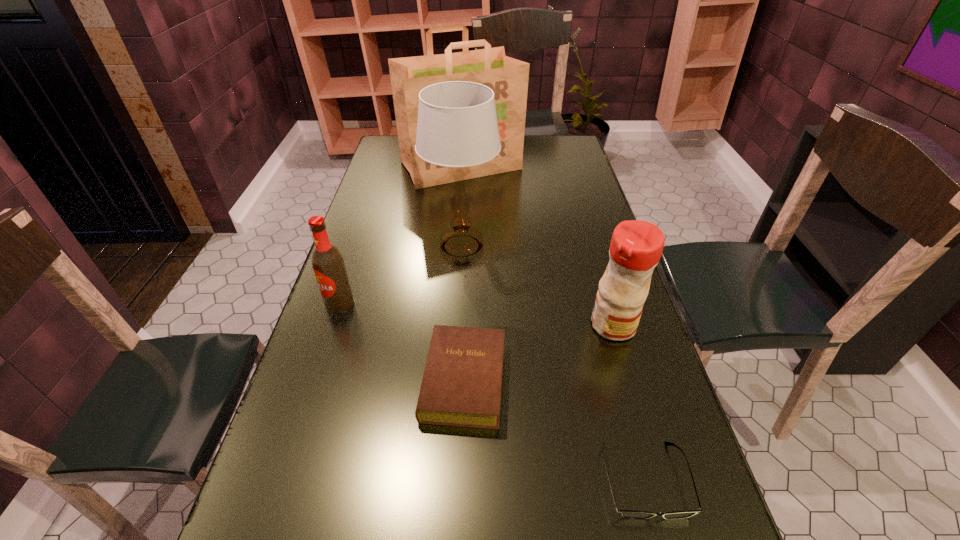
The width and height of the screenshot is (960, 540). I want to click on the farthest object, so click(x=508, y=78).

The height and width of the screenshot is (540, 960). Identify the location of the second farthest object. (457, 127).

You are a GUI agent. You are given a task and a screenshot of the screen. Output one action in this format:
    pyautogui.click(x=<x>, y=<y>)
    Task: Click on the condiment
    This screenshot has width=960, height=540.
    Given the screenshot: What is the action you would take?
    pyautogui.click(x=636, y=246)

Where is `the leftmost object`? the leftmost object is located at coordinates (327, 261).

Identify the location of the fifth tallest object. (461, 386).

Find the location of a particular element. The height and width of the screenshot is (540, 960). the shortest object is located at coordinates (631, 514).

This screenshot has width=960, height=540. Identify the location of spectacles. (631, 514).

Where is `free space located on the front of the farthest object`? Image resolution: width=960 pixels, height=540 pixels. free space located on the front of the farthest object is located at coordinates coord(455,257).

You are a GUI agent. You are given a task and a screenshot of the screen. Output one action in this format:
    pyautogui.click(x=<x>, y=<y>)
    Task: Click on the vacant region located 0.270m on the front-facing side of the second farthest object
    This screenshot has width=960, height=540.
    Given the screenshot: What is the action you would take?
    pyautogui.click(x=457, y=343)

Image resolution: width=960 pixels, height=540 pixels. In order to click on vacant region located on the front of the condiment in this screenshot , I will do `click(659, 476)`.